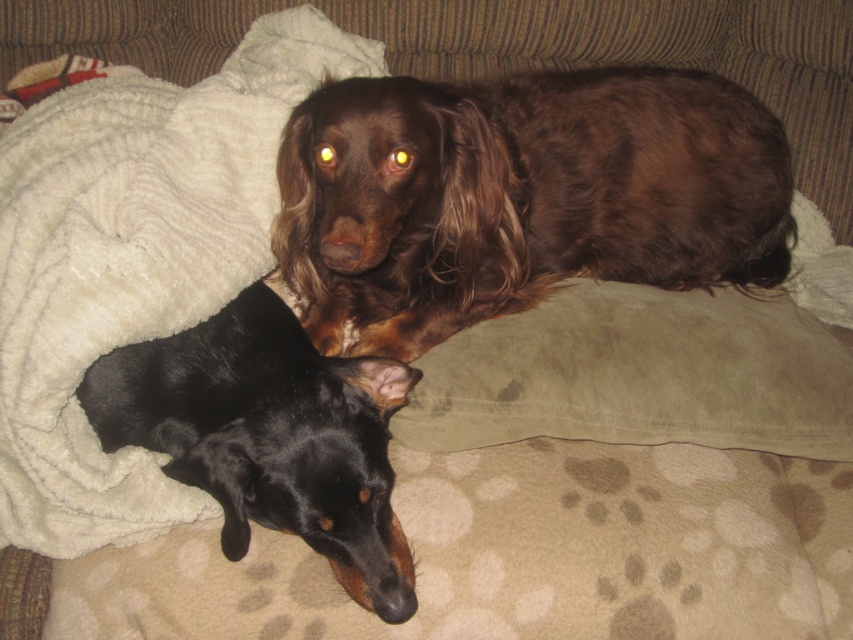
You are a photographer trying to capture a candid shot of the two dogs on the couch. You notice two specific points marked on the couch. One is at point (706, 211) and the other is at point (106, 380). Which point is closer to the back of the couch?

Point (706, 211) is behind point (106, 380), so it is closer to the back of the couch.

You are a photographer trying to capture both dogs in a single frame. The camera can only focus on objects within a 1.5 meter width. Given the brown furry dog at upper center and the black smooth dog at lower left, will both fit within the camera frame?

The brown furry dog at upper center is wider than the black smooth dog at lower left. Since the camera can focus on objects within a 1.5 meter width, both dogs can fit as long as their combined width does not exceed the frame limit. However, the exact combined width isn